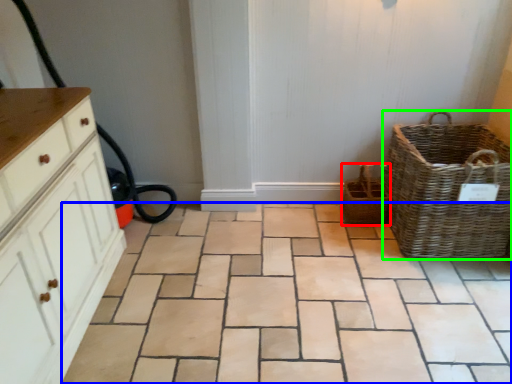
Question: Which object is the farthest from basket (highlighted by a red box)? Choose among these: ceramic tile (highlighted by a blue box) or picnic basket (highlighted by a green box).

Choices:
 (A) ceramic tile
 (B) picnic basket

Answer: (A)